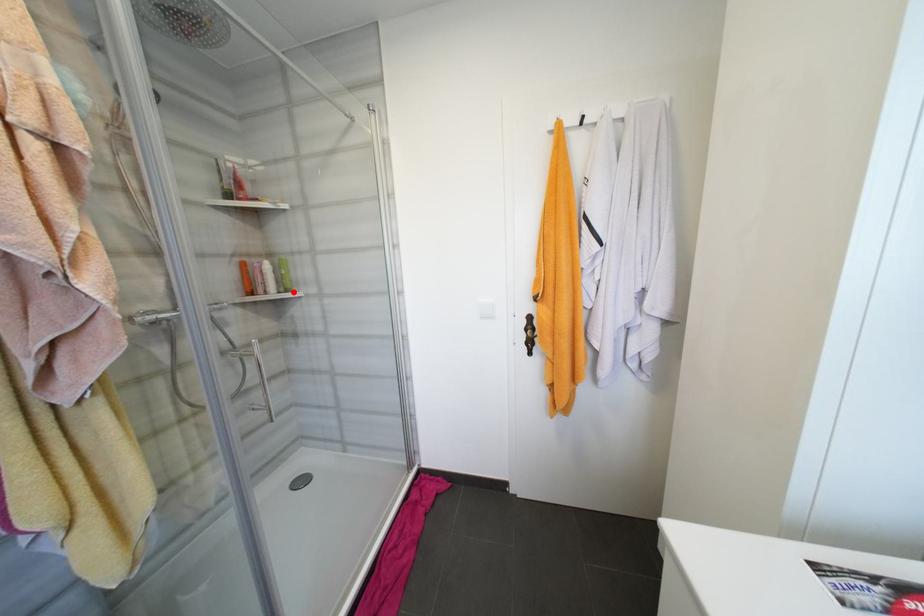
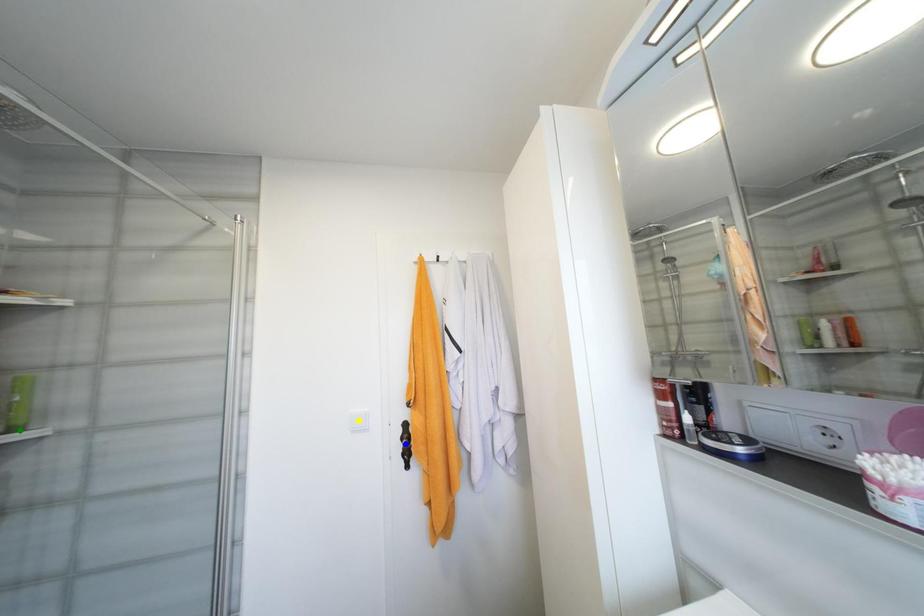
Question: I am providing you with two images of the same scene from different viewpoints. A red point is marked on the first image. You are given multiple points on the second image. In image 2, which mark is for the same physical point as the one in image 1?

Choices:
 (A) green point
 (B) blue point
 (C) yellow point

Answer: (A)